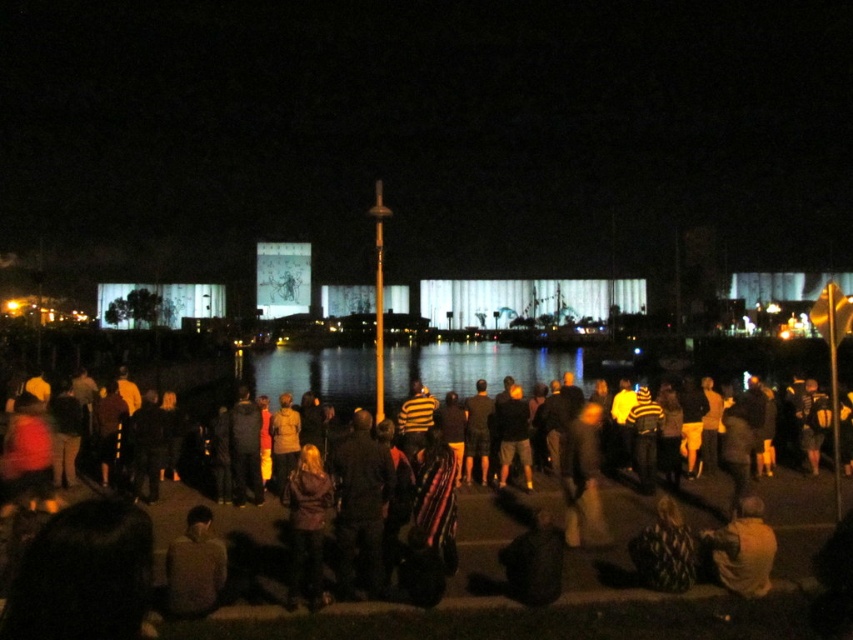
You are a photographer at the event and want to capture the illuminated structures in the background without the dark clothing crowd at center blocking the view. Where should you position yourself relative to the crowd?

You should position yourself to the left or right of the dark clothing crowd at center, as they are located at point (503, 573), which is near the center of the image. Moving to the sides would allow you to frame the shot around them and capture the illuminated structures without obstruction.

Based on the photo, you are a photographer trying to capture the entire scene of the dark clothing crowd at center and the transparent glass water at center in one shot. Which object will require you to adjust your camera angle more to include its full width in the photo?

The dark clothing crowd at center requires adjusting the camera angle more because its width surpasses that of the transparent glass water at center.

You are a photographer standing at the edge of the dark clothing crowd at center. You want to take a photo of the transparent glass water at center without including the crowd in the frame. Is it possible to do so by moving forward or backward? Explain your reasoning based on their positions.

The dark clothing crowd at center is closer to the viewer than the transparent glass water at center. If you move backward, the distance between you and both objects increases, but the crowd remains in front of the water. Moving forward would bring you closer to the crowd, making it harder to exclude them. Therefore, it might not be possible to avoid including the crowd in the photo since they are positioned in front of the water from the photographer s perspective.